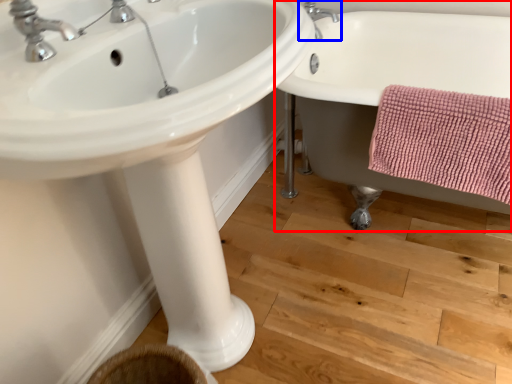
Question: Which point is further to the camera, bathtub (highlighted by a red box) or tap (highlighted by a blue box)?

Choices:
 (A) bathtub
 (B) tap

Answer: (B)